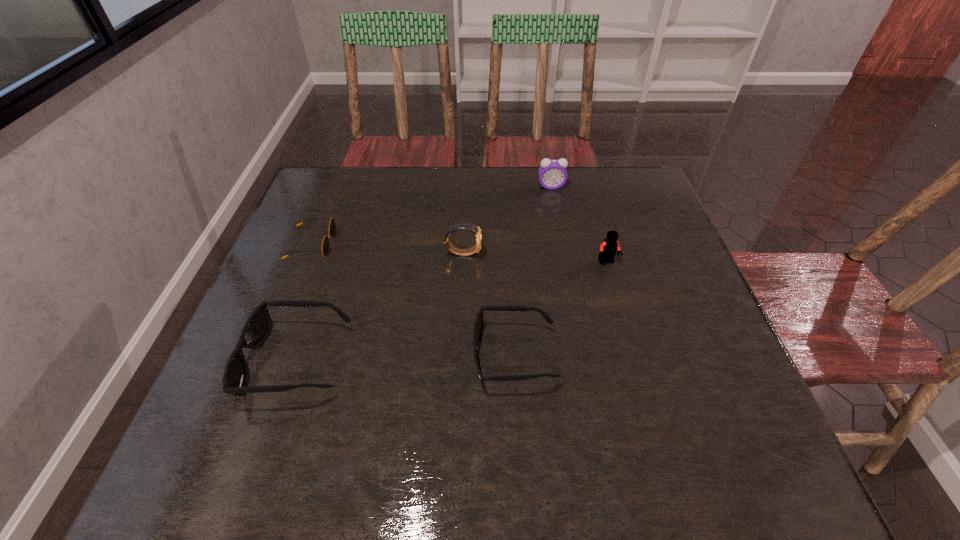
Where is `free point between the shortest sunglasses and the fifth object from left to right`? This screenshot has height=540, width=960. free point between the shortest sunglasses and the fifth object from left to right is located at coordinates (431, 215).

Locate an element on the screen. The image size is (960, 540). free space that is in between the alarm clock and the shortest object is located at coordinates (431, 215).

Where is `free space between the rightmost object and the fifth object from left to right`? The height and width of the screenshot is (540, 960). free space between the rightmost object and the fifth object from left to right is located at coordinates pos(579,224).

Identify which object is located as the nearest to the tallest sunglasses. Please provide its 2D coordinates. Your answer should be formatted as a tuple, i.e. [(x, y)], where the tuple contains the x and y coordinates of a point satisfying the conditions above.

[(332, 225)]

This screenshot has height=540, width=960. Find the location of `object that stands as the fifth closest to the tallest sunglasses`. object that stands as the fifth closest to the tallest sunglasses is located at coordinates pos(552,173).

Identify which sunglasses is the second nearest to the fifth object from left to right. Please provide its 2D coordinates. Your answer should be formatted as a tuple, i.e. [(x, y)], where the tuple contains the x and y coordinates of a point satisfying the conditions above.

[(332, 225)]

Locate which sunglasses is the closest to the third shortest object. Please provide its 2D coordinates. Your answer should be formatted as a tuple, i.e. [(x, y)], where the tuple contains the x and y coordinates of a point satisfying the conditions above.

[(332, 225)]

Locate an element on the screen. The height and width of the screenshot is (540, 960). free space that satisfies the following two spatial constraints: 1. on the front-facing side of the Lego; 2. on the front-facing side of the second shortest sunglasses is located at coordinates (634, 356).

Locate an element on the screen. This screenshot has height=540, width=960. vacant space that satisfies the following two spatial constraints: 1. on the face of the farthest object; 2. on the front-facing side of the fourth tallest object is located at coordinates (585, 361).

Identify the location of free spot that satisfies the following two spatial constraints: 1. on the face of the second object from right to left; 2. on the front-facing side of the fifth tallest object. (584, 356).